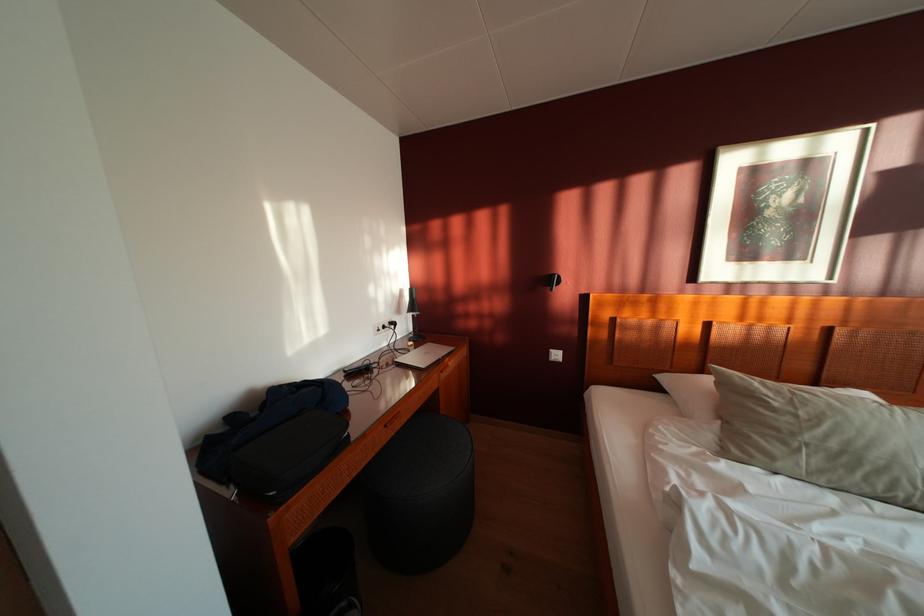
Describe the element at coordinates (383, 326) in the screenshot. This screenshot has width=924, height=616. I see `the black power plug` at that location.